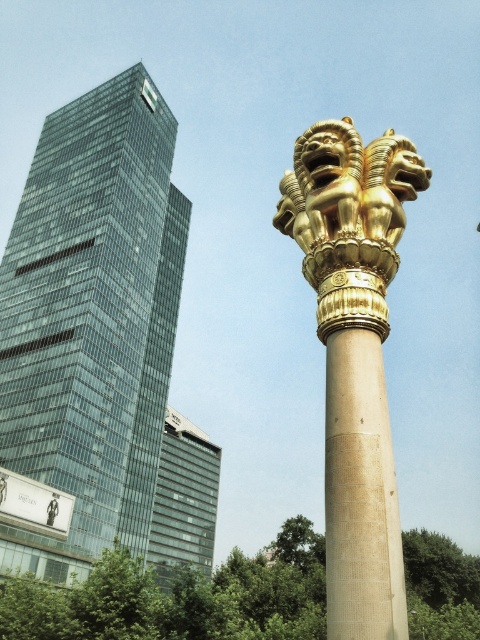
Question: Is glassy metallic skyscraper at left to the right of gold polished column at center from the viewer's perspective?

Choices:
 (A) no
 (B) yes

Answer: (A)

Question: Which of the following is the closest to the observer?

Choices:
 (A) (197, 460)
 (B) (302, 228)
 (C) (58, 154)
 (D) (386, 448)

Answer: (D)

Question: Which of the following is the farthest from the observer?

Choices:
 (A) (168, 522)
 (B) (165, 364)
 (C) (332, 417)

Answer: (A)

Question: Which point is farther to the camera?

Choices:
 (A) (335, 600)
 (B) (365, 593)
 (C) (145, 472)

Answer: (C)

Question: Is gold polished column at center positioned in front of glassy reflective building at center?

Choices:
 (A) yes
 (B) no

Answer: (A)

Question: Does glassy metallic skyscraper at left appear over beige stone column at center?

Choices:
 (A) yes
 (B) no

Answer: (A)